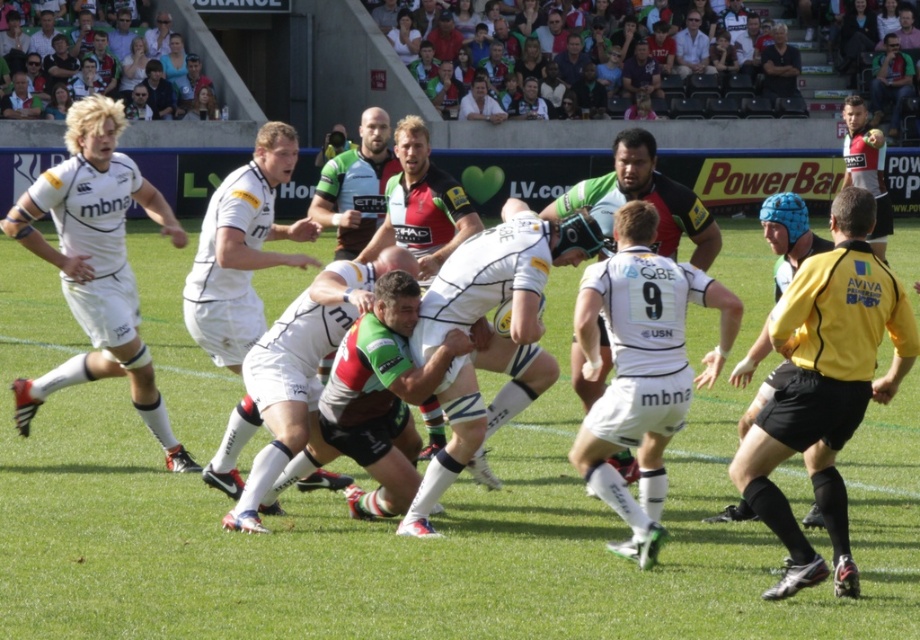
You are a rugby player positioned at the center of the field. You need to reach the point marked at coordinates point (144, 544) as quickly as possible. Considering your current position, in which direction should you sprint to reach that point?

The point (144, 544) is 25.50 feet from the viewer, so you should sprint directly towards it to cover the shortest distance.

You are a photographer standing at the edge of the rugby field. You want to take a photo that includes both the point at coordinates point(214, 211) and point(319, 224). Which point will appear larger in your photo?

Point(214, 211) is closer to the camera than point(319, 224), so it will appear larger in the photo.